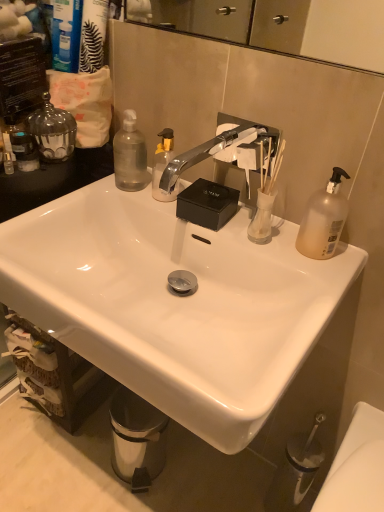
You are a GUI agent. You are given a task and a screenshot of the screen. Output one action in this format:
    pyautogui.click(x=<x>, y=<y>)
    Task: Click on the white glossy sink at center
    This screenshot has height=512, width=384.
    Given the screenshot: What is the action you would take?
    pyautogui.click(x=174, y=303)

This screenshot has height=512, width=384. Describe the element at coordinates (137, 439) in the screenshot. I see `stainless steel trash can at lower left` at that location.

Where is `white glossy sink at center`? white glossy sink at center is located at coordinates (174, 303).

Is translucent plastic soap dispenser at left, the second toiletry in the right-to-left sequence, to the right of chrome metallic faucet at center from the viewer's perspective?

In fact, translucent plastic soap dispenser at left, the second toiletry in the right-to-left sequence, is to the left of chrome metallic faucet at center.

Is translucent plastic soap dispenser at left, the first toiletry when ordered from left to right, facing towards chrome metallic faucet at center?

No, translucent plastic soap dispenser at left, the first toiletry when ordered from left to right, is not turned towards chrome metallic faucet at center.

Is point (9, 158) more distant than point (220, 144)?

No, it is not.

From a real-world perspective, does translucent plastic soap dispenser at left, the second toiletry in the right-to-left sequence, stand above chrome metallic faucet at center?

No, from a real-world perspective, translucent plastic soap dispenser at left, the second toiletry in the right-to-left sequence, is not on top of chrome metallic faucet at center.

Considering the sizes of white glossy sink at center and translucent plastic soap dispenser at left, the second toiletry in the right-to-left sequence, in the image, is white glossy sink at center taller or shorter than translucent plastic soap dispenser at left, the second toiletry in the right-to-left sequence,?

white glossy sink at center is taller than translucent plastic soap dispenser at left, the second toiletry in the right-to-left sequence.

Is white glossy sink at center not near translucent plastic soap dispenser at left, the second toiletry in the right-to-left sequence?

No, white glossy sink at center is not far away from translucent plastic soap dispenser at left, the second toiletry in the right-to-left sequence.

Is white glossy sink at center situated inside translucent plastic soap dispenser at left, the second toiletry in the right-to-left sequence, or outside?

white glossy sink at center is outside translucent plastic soap dispenser at left, the second toiletry in the right-to-left sequence.

Considering the relative sizes of white glossy sink at center and translucent plastic soap dispenser at left, the second toiletry in the right-to-left sequence, in the image provided, is white glossy sink at center bigger than translucent plastic soap dispenser at left, the second toiletry in the right-to-left sequence,?

Correct, white glossy sink at center is larger in size than translucent plastic soap dispenser at left, the second toiletry in the right-to-left sequence.

From a real-world perspective, between metallic silver soap dispenser at left, the 1th toiletry positioned from the right, and transparent plastic bottle at upper left, the 2th bottle in the right-to-left sequence, who is vertically lower?

transparent plastic bottle at upper left, the 2th bottle in the right-to-left sequence, from a real-world perspective.

Would you say metallic silver soap dispenser at left, the 1th toiletry positioned from the right, contains transparent plastic bottle at upper left, which is the first bottle from left to right?

No, transparent plastic bottle at upper left, which is the first bottle from left to right, is not a part of metallic silver soap dispenser at left, the 1th toiletry positioned from the right.

From the image's perspective, is metallic silver soap dispenser at left, the 1th toiletry positioned from the right, located above transparent plastic bottle at upper left, which is the first bottle from left to right?

No, from the image's perspective, metallic silver soap dispenser at left, the 1th toiletry positioned from the right, is not above transparent plastic bottle at upper left, which is the first bottle from left to right.

Considering the sizes of metallic silver soap dispenser at left, the 1th toiletry positioned from the right, and transparent plastic bottle at upper left, which is the 2th bottle from front to back, in the image, is metallic silver soap dispenser at left, the 1th toiletry positioned from the right, taller or shorter than transparent plastic bottle at upper left, which is the 2th bottle from front to back,?

Clearly, metallic silver soap dispenser at left, the 1th toiletry positioned from the right, is shorter compared to transparent plastic bottle at upper left, which is the 2th bottle from front to back.

In terms of width, does translucent plastic pump bottle at right, the 2th bottle in the left-to-right sequence, look wider or thinner when compared to transparent plastic bottle at upper left, which is the 1th bottle from back to front?

In the image, translucent plastic pump bottle at right, the 2th bottle in the left-to-right sequence, appears to be more narrow than transparent plastic bottle at upper left, which is the 1th bottle from back to front.

Considering the positions of objects translucent plastic pump bottle at right, which is the first bottle in right-to-left order, and transparent plastic bottle at upper left, the 2th bottle in the right-to-left sequence, in the image provided, who is in front, translucent plastic pump bottle at right, which is the first bottle in right-to-left order, or transparent plastic bottle at upper left, the 2th bottle in the right-to-left sequence,?

translucent plastic pump bottle at right, which is the first bottle in right-to-left order, is in front.

From the image's perspective, which one is positioned higher, translucent plastic pump bottle at right, the 2th bottle in the left-to-right sequence, or transparent plastic bottle at upper left, which is the first bottle from left to right?

transparent plastic bottle at upper left, which is the first bottle from left to right, is shown above in the image.

Choose the correct answer: Is translucent plastic pump bottle at right, which is counted as the first bottle, starting from the front, inside transparent plastic bottle at upper left, the 2th bottle in the right-to-left sequence, or outside it?

translucent plastic pump bottle at right, which is counted as the first bottle, starting from the front, is not enclosed by transparent plastic bottle at upper left, the 2th bottle in the right-to-left sequence.

Find the location of a particular element. The height and width of the screenshot is (512, 384). toiletry behind the metallic silver soap dispenser at left, the 1th toiletry positioned from the right is located at coordinates (8, 163).

Looking at this image, are metallic silver soap dispenser at left, the 1th toiletry positioned from the right, and translucent plastic soap dispenser at left, the first toiletry when ordered from left to right, making contact?

Yes, metallic silver soap dispenser at left, the 1th toiletry positioned from the right, is right next to translucent plastic soap dispenser at left, the first toiletry when ordered from left to right, and making contact.

From a real-world perspective, is metallic silver soap dispenser at left, the 1th toiletry positioned from the right, positioned under translucent plastic soap dispenser at left, the second toiletry in the right-to-left sequence, based on gravity?

Actually, metallic silver soap dispenser at left, the 1th toiletry positioned from the right, is physically above translucent plastic soap dispenser at left, the second toiletry in the right-to-left sequence, in the real world.

In the scene shown: Is metallic silver soap dispenser at left, the second toiletry from the left, to the left or to the right of translucent plastic soap dispenser at left, the second toiletry in the right-to-left sequence, in the image?

From the image, it's evident that metallic silver soap dispenser at left, the second toiletry from the left, is to the right of translucent plastic soap dispenser at left, the second toiletry in the right-to-left sequence.

Can we say translucent plastic pump bottle at right, the 2th bottle in the left-to-right sequence, lies outside translucent plastic soap dispenser at left, the first toiletry when ordered from left to right?

Indeed, translucent plastic pump bottle at right, the 2th bottle in the left-to-right sequence, is completely outside translucent plastic soap dispenser at left, the first toiletry when ordered from left to right.

Is translucent plastic pump bottle at right, which is the first bottle in right-to-left order, positioned with its back to translucent plastic soap dispenser at left, the second toiletry in the right-to-left sequence?

No, translucent plastic pump bottle at right, which is the first bottle in right-to-left order, is not facing away from translucent plastic soap dispenser at left, the second toiletry in the right-to-left sequence.

Between translucent plastic pump bottle at right, the 2th bottle in the left-to-right sequence, and translucent plastic soap dispenser at left, the second toiletry in the right-to-left sequence, which one appears on the left side from the viewer's perspective?

translucent plastic soap dispenser at left, the second toiletry in the right-to-left sequence, is more to the left.

How much distance is there between translucent plastic pump bottle at right, the 2th bottle when ordered from back to front, and translucent plastic soap dispenser at left, the second toiletry in the right-to-left sequence?

The distance of translucent plastic pump bottle at right, the 2th bottle when ordered from back to front, from translucent plastic soap dispenser at left, the second toiletry in the right-to-left sequence, is 24.85 inches.

Is translucent plastic soap dispenser at left, the second toiletry in the right-to-left sequence, next to stainless steel trash can at lower left and touching it?

translucent plastic soap dispenser at left, the second toiletry in the right-to-left sequence, and stainless steel trash can at lower left are not in contact.

Which object is closer to the camera, translucent plastic soap dispenser at left, the first toiletry when ordered from left to right, or stainless steel trash can at lower left?

translucent plastic soap dispenser at left, the first toiletry when ordered from left to right, is closer to the camera.

From the image's perspective, is translucent plastic soap dispenser at left, the first toiletry when ordered from left to right, above stainless steel trash can at lower left?

Yes, from the image's perspective, translucent plastic soap dispenser at left, the first toiletry when ordered from left to right, is above stainless steel trash can at lower left.

Identify the location of toiletry that is the 2nd one when counting backward from the chrome metallic faucet at center. Image resolution: width=384 pixels, height=512 pixels. (8, 163).

In the image, there is a translucent plastic soap dispenser at left, the first toiletry when ordered from left to right. Identify the location of sink below it (from the image's perspective). The image size is (384, 512). (174, 303).

Considering their positions, is translucent plastic soap dispenser at left, the second toiletry in the right-to-left sequence, positioned further to metallic silver soap dispenser at left, the 1th toiletry positioned from the right, than white glossy sink at center?

white glossy sink at center.

Which object lies nearer to the anchor point white glossy sink at center, stainless steel trash can at lower left or translucent plastic pump bottle at right, the 2th bottle in the left-to-right sequence?

translucent plastic pump bottle at right, the 2th bottle in the left-to-right sequence, lies closer to white glossy sink at center than the other object.

Estimate the real-world distances between objects in this image. Which object is closer to stainless steel trash can at lower left, chrome metallic faucet at center or white glossy sink at center?

white glossy sink at center lies closer to stainless steel trash can at lower left than the other object.

Looking at the image, which one is located closer to metallic silver soap dispenser at left, the 1th toiletry positioned from the right, translucent plastic soap dispenser at left, the second toiletry in the right-to-left sequence, or translucent plastic pump bottle at right, the 2th bottle in the left-to-right sequence?

The object closer to metallic silver soap dispenser at left, the 1th toiletry positioned from the right, is translucent plastic soap dispenser at left, the second toiletry in the right-to-left sequence.

Based on their spatial positions, is white glossy sink at center or translucent plastic soap dispenser at left, the first toiletry when ordered from left to right, closer to translucent plastic pump bottle at right, the 2th bottle when ordered from back to front?

Based on the image, white glossy sink at center appears to be nearer to translucent plastic pump bottle at right, the 2th bottle when ordered from back to front.

When comparing their distances from white glossy sink at center, does stainless steel trash can at lower left or chrome metallic faucet at center seem further?

stainless steel trash can at lower left.

Estimate the real-world distances between objects in this image. Which object is closer to transparent plastic bottle at upper left, the 2th bottle in the right-to-left sequence, translucent plastic pump bottle at right, the 2th bottle in the left-to-right sequence, or metallic silver soap dispenser at left, the 1th toiletry positioned from the right?

metallic silver soap dispenser at left, the 1th toiletry positioned from the right, is closer to transparent plastic bottle at upper left, the 2th bottle in the right-to-left sequence.

Looking at this image, from the image, which object appears to be nearer to transparent plastic bottle at upper left, which is the 1th bottle from back to front, metallic silver soap dispenser at left, the 1th toiletry positioned from the right, or translucent plastic soap dispenser at left, the first toiletry when ordered from left to right?

Based on the image, metallic silver soap dispenser at left, the 1th toiletry positioned from the right, appears to be nearer to transparent plastic bottle at upper left, which is the 1th bottle from back to front.

Image resolution: width=384 pixels, height=512 pixels. Identify the location of faucet situated between metallic silver soap dispenser at left, the 1th toiletry positioned from the right, and translucent plastic pump bottle at right, which is the first bottle in right-to-left order, from left to right. (208, 152).

Where is `bottle between translucent plastic soap dispenser at left, the first toiletry when ordered from left to right, and stainless steel trash can at lower left vertically`? bottle between translucent plastic soap dispenser at left, the first toiletry when ordered from left to right, and stainless steel trash can at lower left vertically is located at coordinates (323, 219).

In order to click on bottle located between metallic silver soap dispenser at left, the second toiletry from the left, and translucent plastic pump bottle at right, the 2th bottle when ordered from back to front, in the left-right direction in this screenshot , I will do `click(130, 155)`.

Where is `bottle that lies between chrome metallic faucet at center and stainless steel trash can at lower left from top to bottom`? The width and height of the screenshot is (384, 512). bottle that lies between chrome metallic faucet at center and stainless steel trash can at lower left from top to bottom is located at coordinates (323, 219).